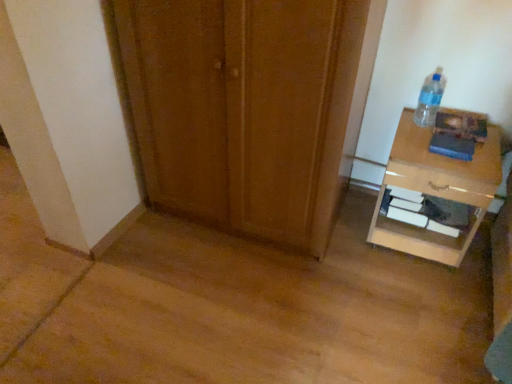
Question: In terms of width, does light brown glossy nightstand at right look wider or thinner when compared to wooden door at center?

Choices:
 (A) wide
 (B) thin

Answer: (B)

Question: In the image, is light brown glossy nightstand at right on the left side or the right side of wooden door at center?

Choices:
 (A) right
 (B) left

Answer: (A)

Question: Estimate the real-world distances between objects in this image. Which object is closer to the clear plastic bottle at upper right?

Choices:
 (A) light brown glossy nightstand at right
 (B) wooden door at center

Answer: (A)

Question: Based on their relative distances, which object is farther from the clear plastic bottle at upper right?

Choices:
 (A) wooden door at center
 (B) light brown glossy nightstand at right

Answer: (A)